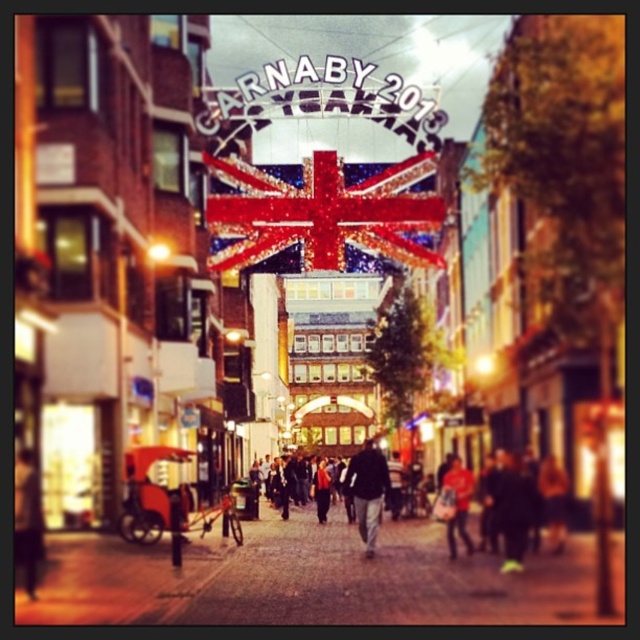
Question: Is shiny fabric flag at center wider than red fabric jacket at center?

Choices:
 (A) no
 (B) yes

Answer: (B)

Question: Which is nearer to the red fabric jacket at center?

Choices:
 (A) dark gray jacket at center
 (B) shiny fabric flag at center

Answer: (A)

Question: Which object appears farthest from the camera in this image?

Choices:
 (A) dark gray jacket at center
 (B) shiny fabric flag at center

Answer: (B)

Question: Is the position of shiny fabric flag at center less distant than that of red fabric jacket at center?

Choices:
 (A) yes
 (B) no

Answer: (B)

Question: Does shiny fabric flag at center appear on the left side of red fabric jacket at center?

Choices:
 (A) no
 (B) yes

Answer: (B)

Question: Among these points, which one is farthest from the camera?

Choices:
 (A) (385, 177)
 (B) (458, 490)
 (C) (380, 476)

Answer: (A)